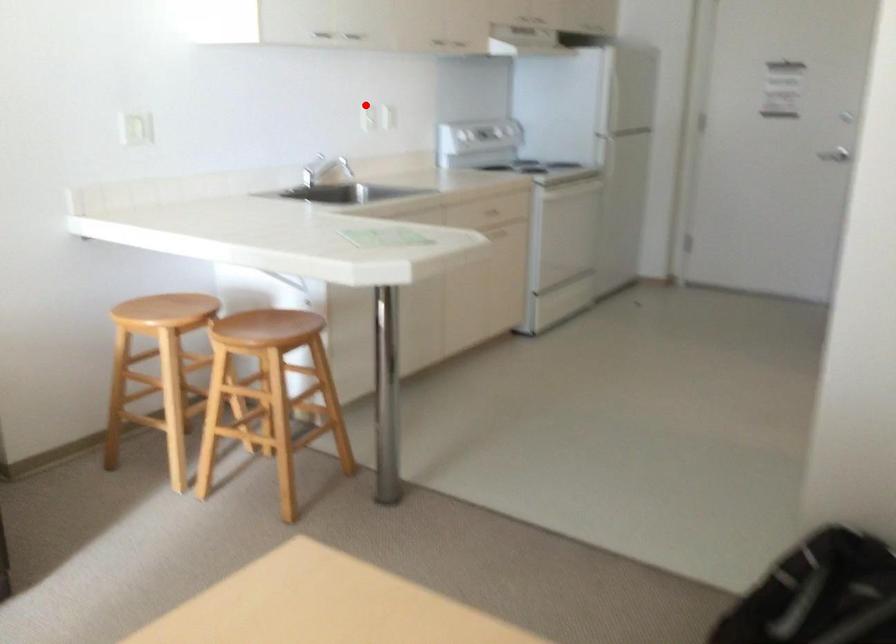
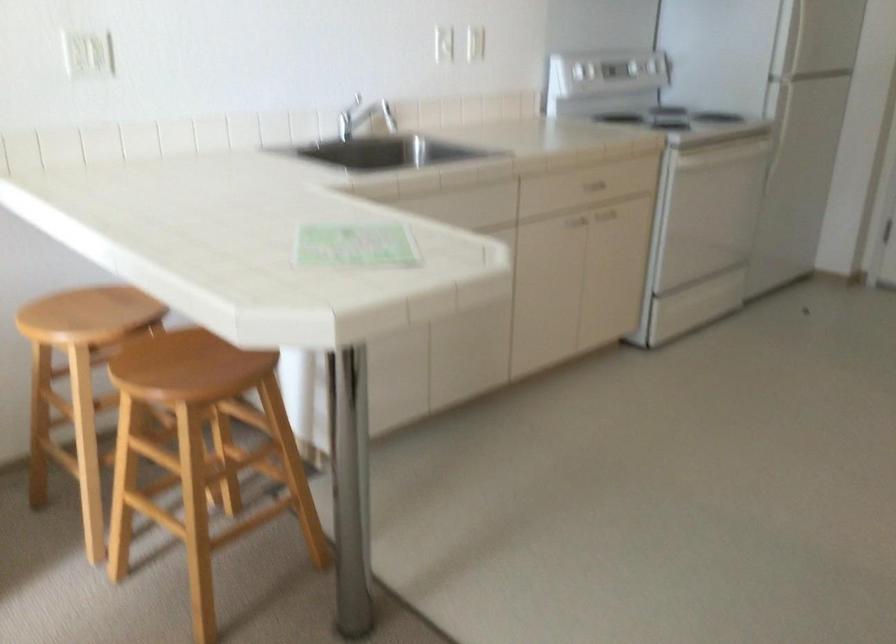
In the second image, find the point that corresponds to the highlighted location in the first image.

(443, 41)